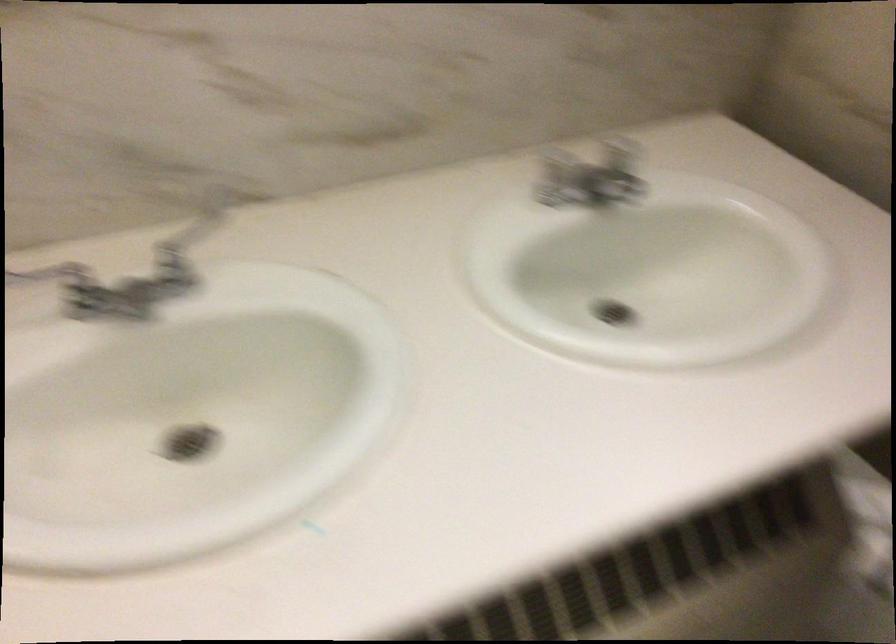
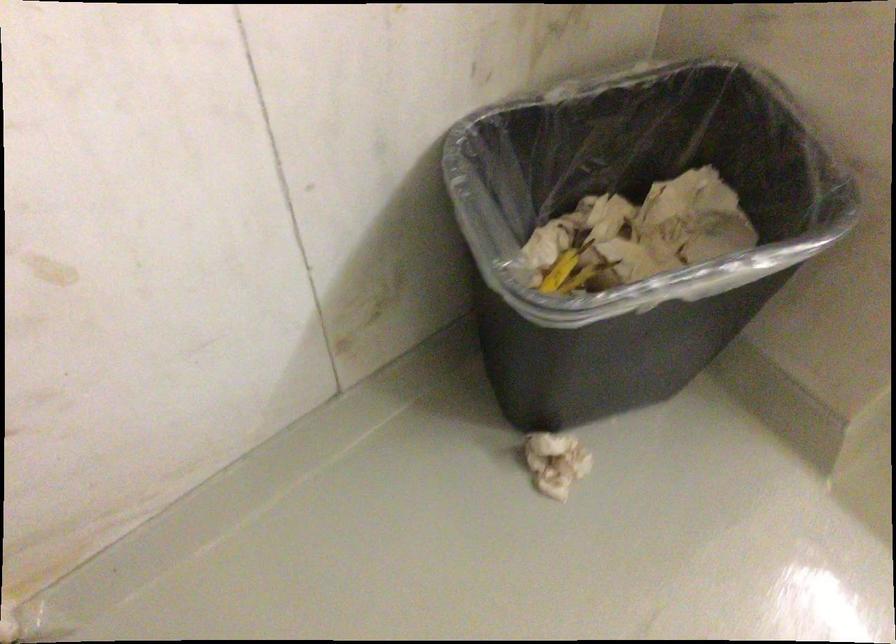
The images are taken continuously from a first-person perspective. In which direction is your viewpoint rotating?

The camera's rotation is toward left-down.